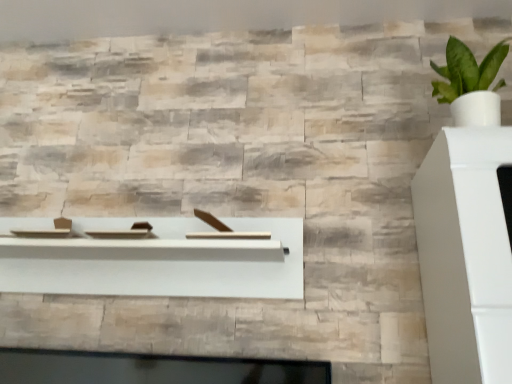
Question: Does green leafy plant in white pot at upper right lie in front of white matte wood shelf at center?

Choices:
 (A) no
 (B) yes

Answer: (B)

Question: Is green leafy plant in white pot at upper right aimed at white matte wood shelf at center?

Choices:
 (A) no
 (B) yes

Answer: (A)

Question: From the image's perspective, is green leafy plant in white pot at upper right on top of white matte wood shelf at center?

Choices:
 (A) no
 (B) yes

Answer: (B)

Question: Is the position of green leafy plant in white pot at upper right more distant than that of white matte wood shelf at center?

Choices:
 (A) yes
 (B) no

Answer: (B)

Question: Are green leafy plant in white pot at upper right and white matte wood shelf at center making contact?

Choices:
 (A) no
 (B) yes

Answer: (A)

Question: Considering the relative sizes of green leafy plant in white pot at upper right and white matte wood shelf at center in the image provided, is green leafy plant in white pot at upper right shorter than white matte wood shelf at center?

Choices:
 (A) yes
 (B) no

Answer: (B)

Question: Is white matte wood shelf at center facing away from natural stone wall at upper center?

Choices:
 (A) yes
 (B) no

Answer: (B)

Question: Is white matte wood shelf at center aimed at natural stone wall at upper center?

Choices:
 (A) yes
 (B) no

Answer: (B)

Question: Can you confirm if white matte wood shelf at center is wider than natural stone wall at upper center?

Choices:
 (A) no
 (B) yes

Answer: (A)

Question: Is white matte wood shelf at center thinner than natural stone wall at upper center?

Choices:
 (A) no
 (B) yes

Answer: (B)

Question: From the image's perspective, is white matte wood shelf at center located beneath natural stone wall at upper center?

Choices:
 (A) yes
 (B) no

Answer: (A)

Question: From the image's perspective, is white matte wood shelf at center on top of natural stone wall at upper center?

Choices:
 (A) yes
 (B) no

Answer: (B)

Question: Does green leafy plant in white pot at upper right have a smaller size compared to natural stone wall at upper center?

Choices:
 (A) yes
 (B) no

Answer: (A)